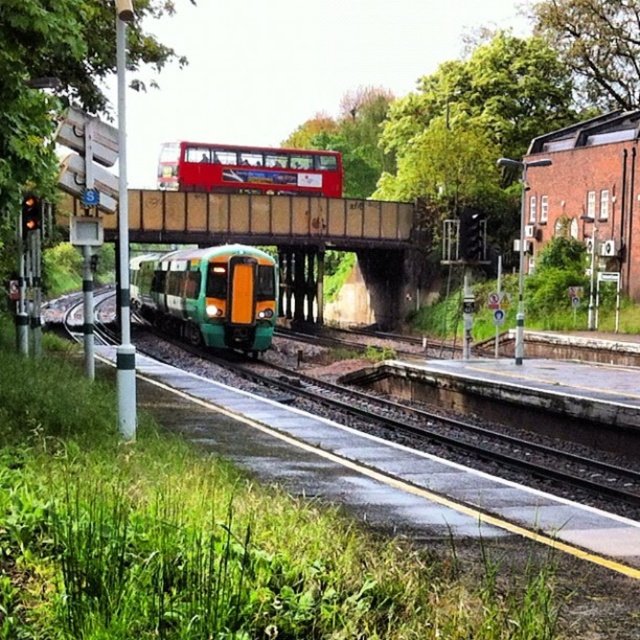
You are a passenger standing on the platform and want to board the green matte train at center. However, you notice a red rubberized bus at upper center parked nearby. Which vehicle is closer to the ground in height?

The green matte train at center has a lesser height compared to the red rubberized bus at upper center, so the green matte train at center is closer to the ground.

You are a passenger on the platform and want to board the green matte train at center and the red rubberized bus at upper center. Which one will you reach first if you start walking towards both from your current position?

You will reach the green matte train at center first because it is closer to you than the red rubberized bus at upper center.

You are a passenger at the railway station and need to board the green matte train at center and the red rubberized bus at upper center. Which one is closer to your current position on the platform?

The green matte train at center is closer to your current position on the platform because it is to the left of the red rubberized bus at upper center, and since the platform is straight, the left side would be nearer.